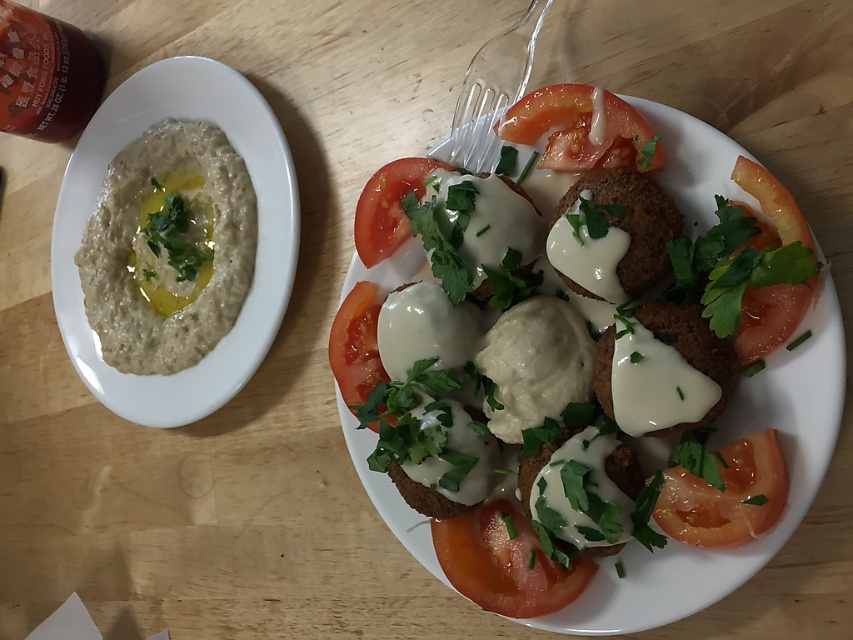
You are a food critic evaluating the presentation of this meal. You notice two main components on the plate. Which component has a greater height between the white creamy falafel at center and the smooth red tomato at center?

The white creamy falafel at center is much taller than the smooth red tomato at center, so the white creamy falafel at center has a greater height.

You are a food delivery robot with a 12 inch wide tray. You need to place a new dish between the slightly translucent tomato at lower right and the transparent plastic fork at upper center. Can your tray fit in that space?

The distance between the slightly translucent tomato at lower right and the transparent plastic fork at upper center is 14.54 inches. Since your tray is 12 inches wide, it can fit in the space between them.

You are a diner sitting at the wooden table and want to pick up the slightly translucent tomato at lower right using the transparent plastic fork at upper center. Can you reach the tomato with the fork without moving either of them?

The slightly translucent tomato at lower right is to the right of the transparent plastic fork at upper center, so the fork cannot reach the tomato without moving either item.